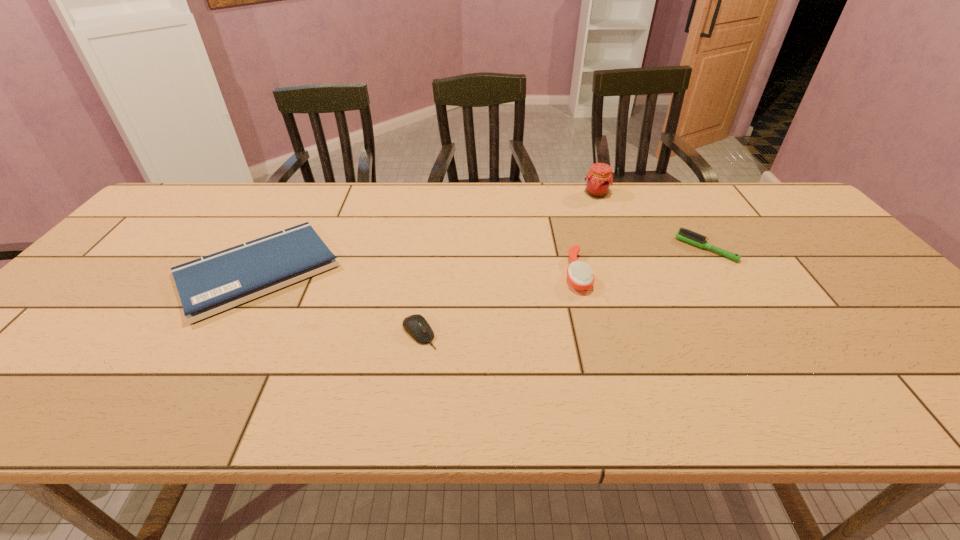
Where is `free space located on the right of the leftmost object`? free space located on the right of the leftmost object is located at coordinates (365, 271).

Locate an element on the screen. The width and height of the screenshot is (960, 540). vacant area situated on the right of the rightmost object is located at coordinates (838, 249).

Where is `vacant point located on the left of the second object from left to right`? vacant point located on the left of the second object from left to right is located at coordinates (300, 333).

Locate an element on the screen. This screenshot has height=540, width=960. object that is at the far edge is located at coordinates (599, 179).

The image size is (960, 540). In order to click on vacant space at the far edge in this screenshot , I will do `click(540, 217)`.

The height and width of the screenshot is (540, 960). In the image, there is a desktop. What are the coordinates of `vacant space at the near edge` in the screenshot? It's located at (89, 390).

In the image, there is a desktop. Identify the location of vacant space at the left edge. (95, 300).

I want to click on vacant region at the far left corner of the desktop, so [174, 195].

At what (x,y) coordinates should I click in order to perform the action: click on free spot at the far right corner of the desktop. Please return your answer as a coordinate pair (x, y). Image resolution: width=960 pixels, height=540 pixels. Looking at the image, I should click on (812, 218).

At what (x,y) coordinates should I click in order to perform the action: click on empty space that is in between the tallest object and the paperback book. Please return your answer as a coordinate pair (x, y). Image resolution: width=960 pixels, height=540 pixels. Looking at the image, I should click on (427, 232).